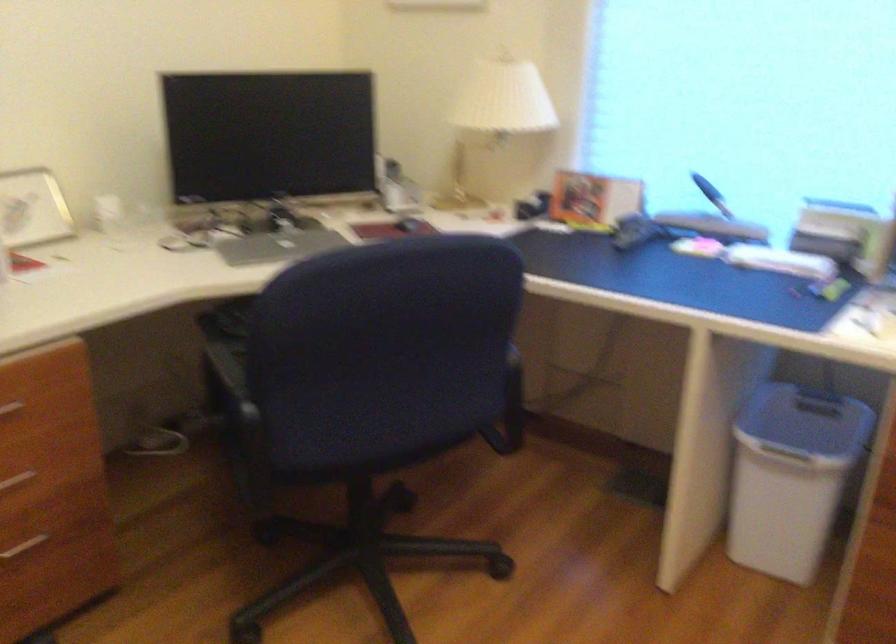
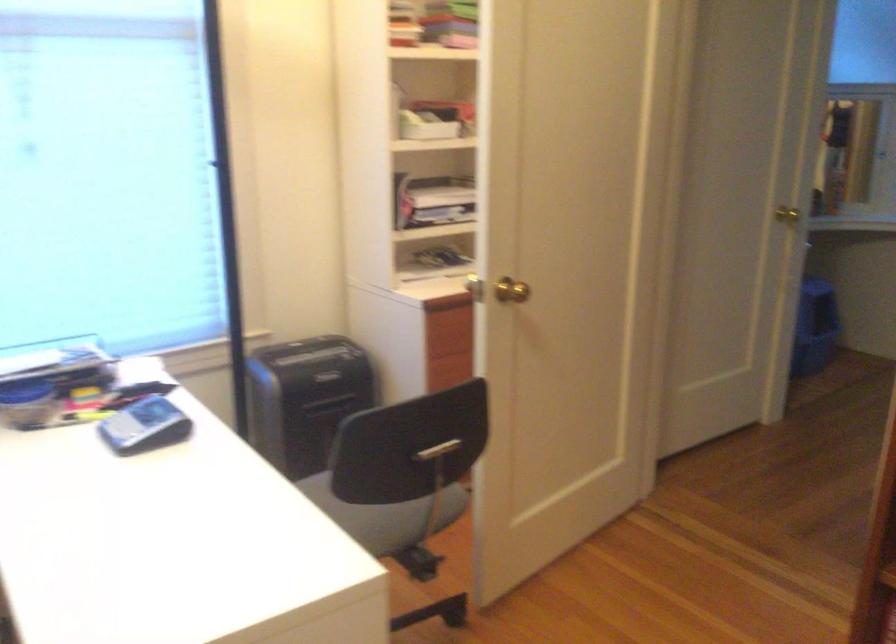
Question: The camera is either moving clockwise (left) or counter-clockwise (right) around the object. The first image is from the beginning of the video and the second image is from the end. Is the camera moving left or right when shooting the video?

Choices:
 (A) Left
 (B) Right

Answer: (A)